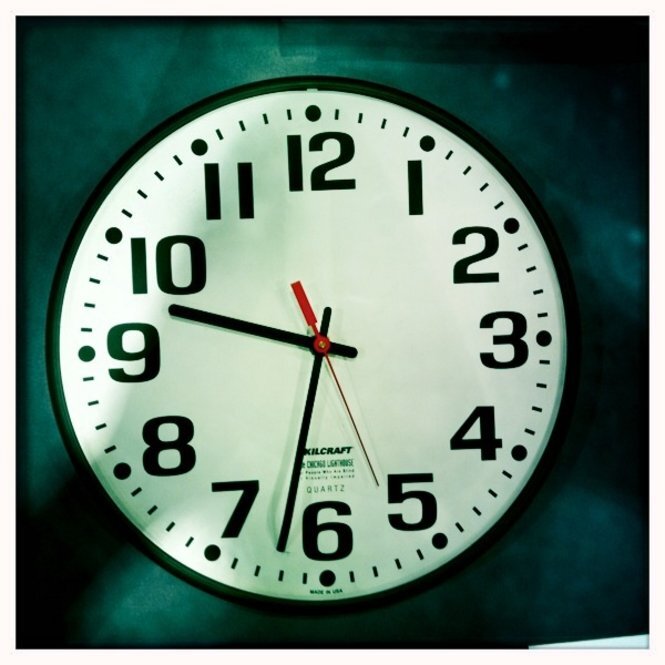
This screenshot has height=665, width=665. What are the coordinates of `clock` in the screenshot? It's located at (350, 108).